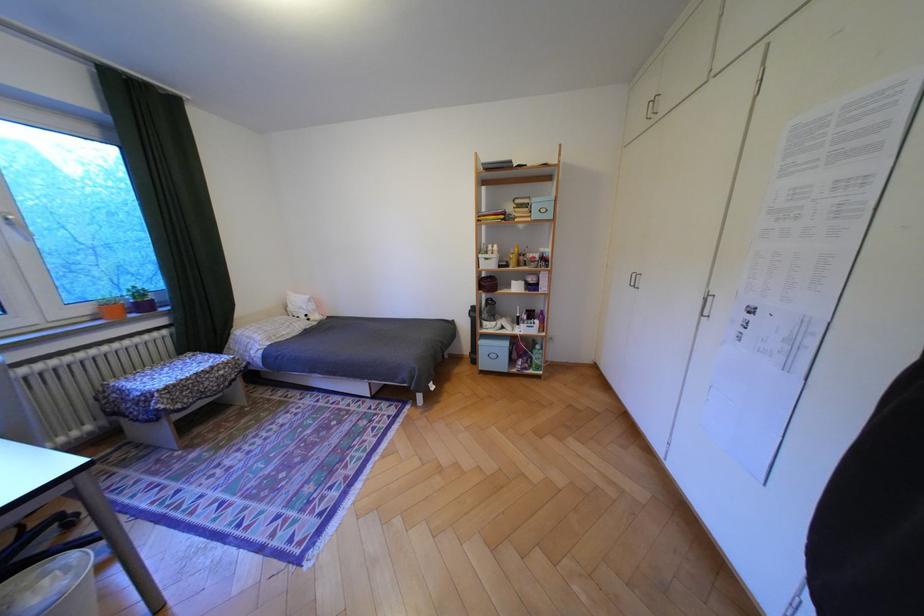
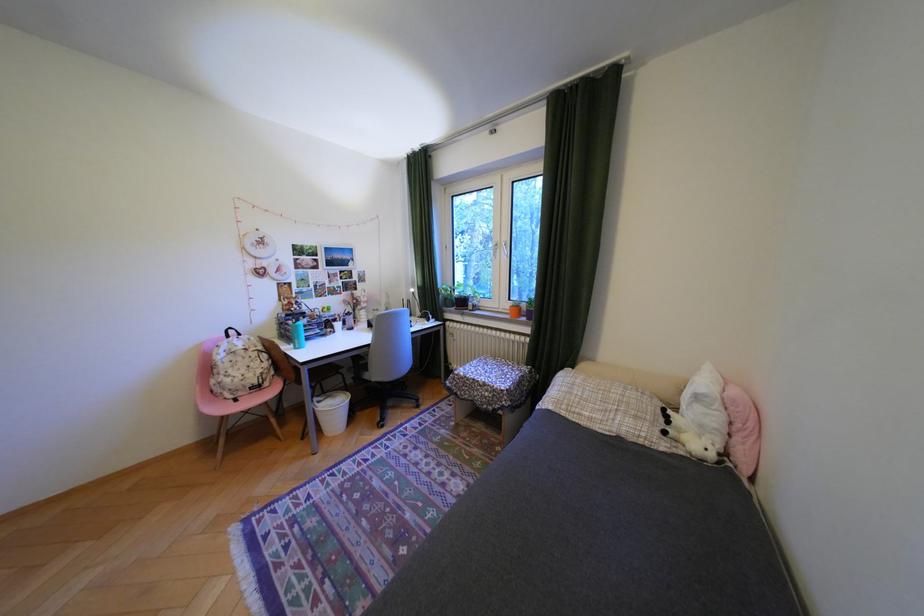
Where in the second image is the point corresponding to [64,329] from the first image?

(514, 313)